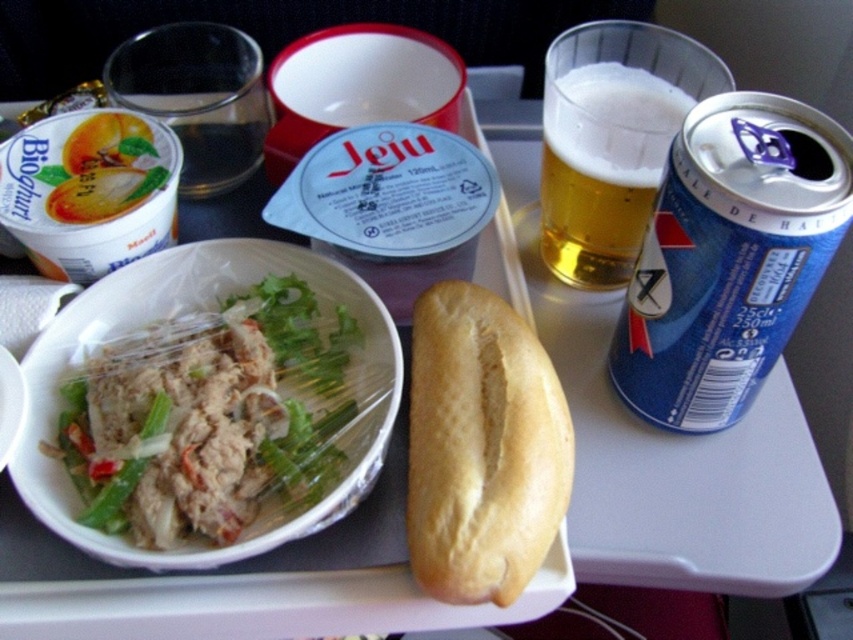
What is the object located at the coordinates point (212, 417) on the airplane meal tray?

The object at point (212, 417) is a white plastic bowl at center left.